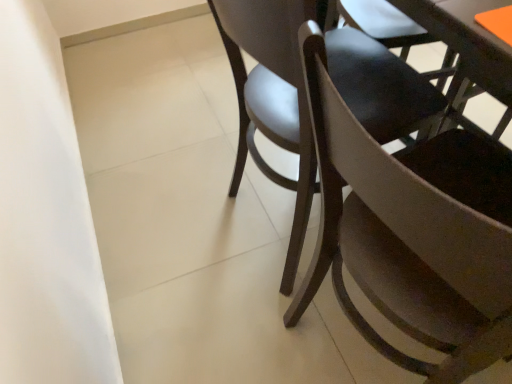
The height and width of the screenshot is (384, 512). Describe the element at coordinates (273, 95) in the screenshot. I see `matte black chair at center, which is the second chair from bottom to top` at that location.

You are a GUI agent. You are given a task and a screenshot of the screen. Output one action in this format:
    pyautogui.click(x=<x>, y=<y>)
    Task: Click on the matte black chair at center, which is the second chair from bottom to top
    The height and width of the screenshot is (384, 512).
    Given the screenshot: What is the action you would take?
    pyautogui.click(x=273, y=95)

What is the approximate height of matte black chair at center, arranged as the 1th chair when viewed from the top?

It is 31.38 inches.

Measure the distance between point (493, 226) and camera.

A distance of 36.30 centimeters exists between point (493, 226) and camera.

I want to click on matte brown chair at center, which is the 1th chair from bottom to top, so click(412, 233).

Describe the element at coordinates (412, 233) in the screenshot. I see `matte brown chair at center, the 2th chair in the top-to-bottom sequence` at that location.

Where is `matte black chair at center, which is the second chair from bottom to top`? matte black chair at center, which is the second chair from bottom to top is located at coordinates (273, 95).

Is matte brown chair at center, the 2th chair in the top-to-bottom sequence, to the right of matte black chair at center, which is the second chair from bottom to top, from the viewer's perspective?

Indeed, matte brown chair at center, the 2th chair in the top-to-bottom sequence, is positioned on the right side of matte black chair at center, which is the second chair from bottom to top.

In the scene shown: Relative to matte black chair at center, arranged as the 1th chair when viewed from the top, is matte brown chair at center, the 2th chair in the top-to-bottom sequence, in front or behind?

Clearly, matte brown chair at center, the 2th chair in the top-to-bottom sequence, is in front of matte black chair at center, arranged as the 1th chair when viewed from the top.

Considering the points (506, 300) and (371, 118), which point is in front, point (506, 300) or point (371, 118)?

The point (506, 300) is closer to the camera.

From the image's perspective, is matte brown chair at center, which is the 1th chair from bottom to top, above or below matte black chair at center, arranged as the 1th chair when viewed from the top?

matte brown chair at center, which is the 1th chair from bottom to top, is situated lower than matte black chair at center, arranged as the 1th chair when viewed from the top, in the image.

From a real-world perspective, is matte brown chair at center, which is the 1th chair from bottom to top, on top of matte black chair at center, arranged as the 1th chair when viewed from the top?

Yes, from a real-world perspective, matte brown chair at center, which is the 1th chair from bottom to top, is over matte black chair at center, arranged as the 1th chair when viewed from the top

Between matte brown chair at center, the 2th chair in the top-to-bottom sequence, and matte black chair at center, which is the second chair from bottom to top, which one has smaller width?

With smaller width is matte brown chair at center, the 2th chair in the top-to-bottom sequence.

Considering the relative sizes of matte brown chair at center, which is the 1th chair from bottom to top, and matte black chair at center, arranged as the 1th chair when viewed from the top, in the image provided, is matte brown chair at center, which is the 1th chair from bottom to top, shorter than matte black chair at center, arranged as the 1th chair when viewed from the top,?

Incorrect, the height of matte brown chair at center, which is the 1th chair from bottom to top, does not fall short of that of matte black chair at center, arranged as the 1th chair when viewed from the top.

Does matte brown chair at center, the 2th chair in the top-to-bottom sequence, have a smaller size compared to matte black chair at center, which is the second chair from bottom to top?

Yes.

Does matte brown chair at center, which is the 1th chair from bottom to top, contain matte black chair at center, arranged as the 1th chair when viewed from the top?

No, matte black chair at center, arranged as the 1th chair when viewed from the top, is located outside of matte brown chair at center, which is the 1th chair from bottom to top.

Is matte brown chair at center, the 2th chair in the top-to-bottom sequence, not close to matte black chair at center, which is the second chair from bottom to top?

matte brown chair at center, the 2th chair in the top-to-bottom sequence, is actually quite close to matte black chair at center, which is the second chair from bottom to top.

Is matte brown chair at center, the 2th chair in the top-to-bottom sequence, oriented towards matte black chair at center, arranged as the 1th chair when viewed from the top?

No, matte brown chair at center, the 2th chair in the top-to-bottom sequence, is not turned towards matte black chair at center, arranged as the 1th chair when viewed from the top.

Can you tell me how much matte brown chair at center, the 2th chair in the top-to-bottom sequence, and matte black chair at center, which is the second chair from bottom to top, differ in facing direction?

There is a 1.13-degree angle between the facing directions of matte brown chair at center, the 2th chair in the top-to-bottom sequence, and matte black chair at center, which is the second chair from bottom to top.

Measure the distance from matte brown chair at center, the 2th chair in the top-to-bottom sequence, to matte black chair at center, which is the second chair from bottom to top.

They are 8.03 inches apart.

Locate an element on the screen. The image size is (512, 384). chair in front of the matte black chair at center, which is the second chair from bottom to top is located at coordinates (412, 233).

Which is more to the left, matte black chair at center, which is the second chair from bottom to top, or matte brown chair at center, the 2th chair in the top-to-bottom sequence?

matte black chair at center, which is the second chair from bottom to top.

Is matte black chair at center, arranged as the 1th chair when viewed from the top, closer to camera compared to matte brown chair at center, the 2th chair in the top-to-bottom sequence?

No, the depth of matte black chair at center, arranged as the 1th chair when viewed from the top, is greater than that of matte brown chair at center, the 2th chair in the top-to-bottom sequence.

Which is behind, point (253, 37) or point (454, 220)?

The point (253, 37) is behind.

From the image's perspective, between matte black chair at center, arranged as the 1th chair when viewed from the top, and matte brown chair at center, the 2th chair in the top-to-bottom sequence, which one is located above?

matte black chair at center, arranged as the 1th chair when viewed from the top.

From a real-world perspective, is matte black chair at center, arranged as the 1th chair when viewed from the top, under matte brown chair at center, the 2th chair in the top-to-bottom sequence?

Indeed, from a real-world perspective, matte black chair at center, arranged as the 1th chair when viewed from the top, is positioned beneath matte brown chair at center, the 2th chair in the top-to-bottom sequence.

Between matte black chair at center, arranged as the 1th chair when viewed from the top, and matte brown chair at center, the 2th chair in the top-to-bottom sequence, which one has smaller width?

matte brown chair at center, the 2th chair in the top-to-bottom sequence, is thinner.

Looking at this image, considering the sizes of matte black chair at center, arranged as the 1th chair when viewed from the top, and matte brown chair at center, the 2th chair in the top-to-bottom sequence, in the image, is matte black chair at center, arranged as the 1th chair when viewed from the top, taller or shorter than matte brown chair at center, the 2th chair in the top-to-bottom sequence,?

In the image, matte black chair at center, arranged as the 1th chair when viewed from the top, appears to be shorter than matte brown chair at center, the 2th chair in the top-to-bottom sequence.

Based on the photo, considering the sizes of objects matte black chair at center, arranged as the 1th chair when viewed from the top, and matte brown chair at center, the 2th chair in the top-to-bottom sequence, in the image provided, who is bigger, matte black chair at center, arranged as the 1th chair when viewed from the top, or matte brown chair at center, the 2th chair in the top-to-bottom sequence,?

matte black chair at center, arranged as the 1th chair when viewed from the top.

Choose the correct answer: Is matte black chair at center, arranged as the 1th chair when viewed from the top, inside matte brown chair at center, which is the 1th chair from bottom to top, or outside it?

matte black chair at center, arranged as the 1th chair when viewed from the top, is spatially situated outside matte brown chair at center, which is the 1th chair from bottom to top.

Is the surface of matte black chair at center, which is the second chair from bottom to top, in direct contact with matte brown chair at center, which is the 1th chair from bottom to top?

No, matte black chair at center, which is the second chair from bottom to top, is not in contact with matte brown chair at center, which is the 1th chair from bottom to top.

Is matte black chair at center, arranged as the 1th chair when viewed from the top, positioned with its back to matte brown chair at center, the 2th chair in the top-to-bottom sequence?

matte black chair at center, arranged as the 1th chair when viewed from the top, is not turned away from matte brown chair at center, the 2th chair in the top-to-bottom sequence.

How different are the orientations of matte black chair at center, arranged as the 1th chair when viewed from the top, and matte brown chair at center, the 2th chair in the top-to-bottom sequence, in degrees?

The facing directions of matte black chair at center, arranged as the 1th chair when viewed from the top, and matte brown chair at center, the 2th chair in the top-to-bottom sequence, are 1.13 degrees apart.

You are a GUI agent. You are given a task and a screenshot of the screen. Output one action in this format:
    pyautogui.click(x=<x>, y=<y>)
    Task: Click on the chair above the matte brown chair at center, the 2th chair in the top-to-bottom sequence (from the image's perspective)
    The height and width of the screenshot is (384, 512).
    Given the screenshot: What is the action you would take?
    pyautogui.click(x=273, y=95)

Find the location of a particular element. Image resolution: width=512 pixels, height=384 pixels. chair lying in front of the matte black chair at center, arranged as the 1th chair when viewed from the top is located at coordinates (412, 233).

Identify the location of chair behind the matte brown chair at center, the 2th chair in the top-to-bottom sequence. (273, 95).